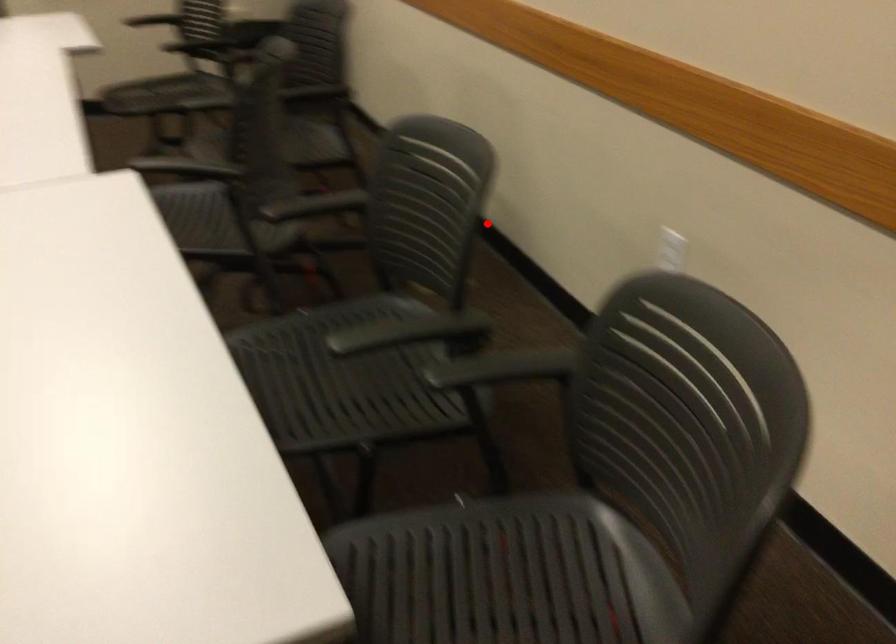
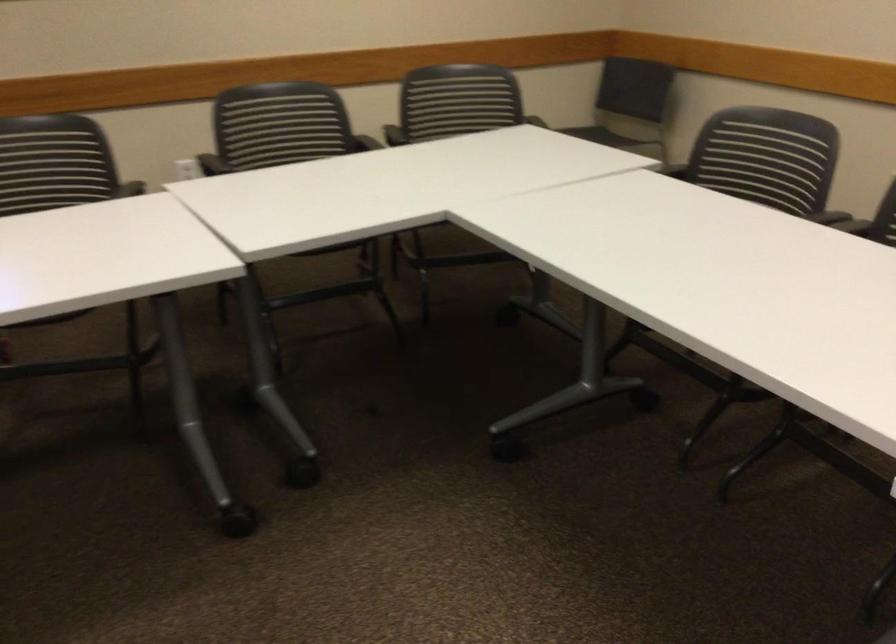
Question: A red point is marked in image1. In image2, is the corresponding 3D point closer to the camera or farther? Reply with the corresponding letter.

Choices:
 (A) The corresponding 3D point is closer.
 (B) The corresponding 3D point is farther.

Answer: (B)